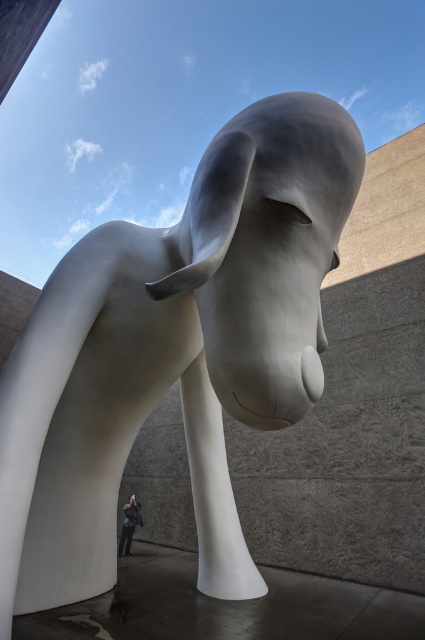
You are an art student who wants to create a miniature version of the scene. You have a limited amount of material. Which object, the white glossy sculpture at center or the blue fabric jacket at lower center, will require more material to replicate in the same scale?

The white glossy sculpture at center requires more material because it has a larger size compared to the blue fabric jacket at lower center.

You are an art curator planning to install these two sculptures in a gallery. The gallery has a height restriction of 3 meters. You need to determine if both sculptures can be displayed without exceeding the height limit. Given that the white glossy sculpture at center is taller than the satin silver sculpture at center, what is the minimum possible height of the taller sculpture to ensure both can fit?

The white glossy sculpture at center is taller than the satin silver sculpture at center. To ensure both can fit under the 3 meter height restriction, the minimum possible height of the taller sculpture must be less than 3 meters. However, without specific measurements, we cannot determine an exact minimum. The curator should verify the exact heights of both sculptures to confirm compliance with the gallery requirements.